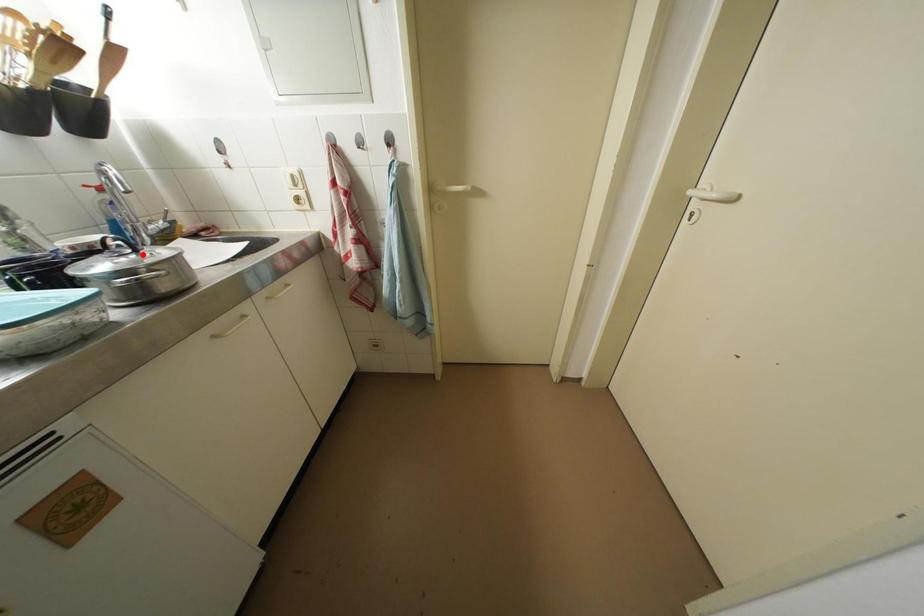
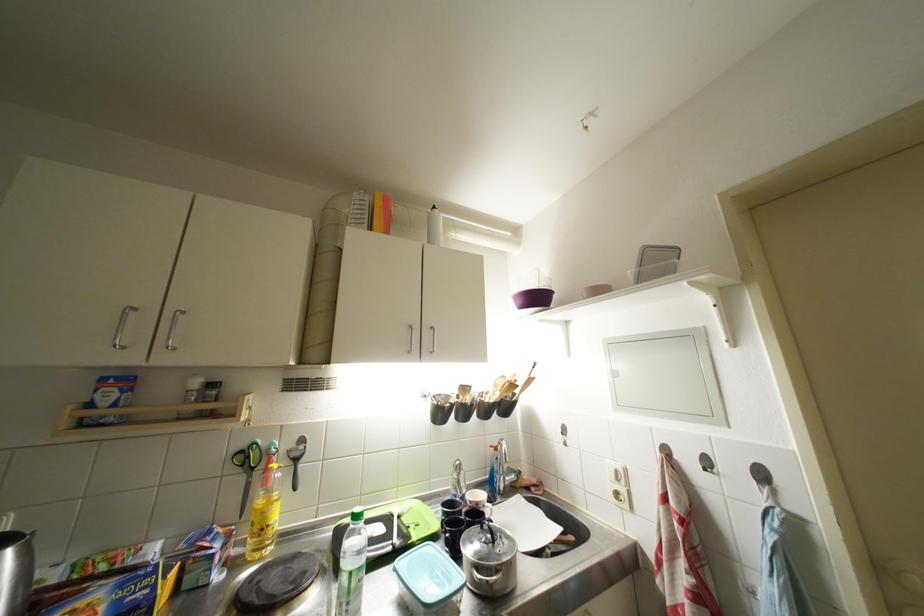
In the second image, find the point that corresponds to the highlighted location in the first image.

(500, 546)